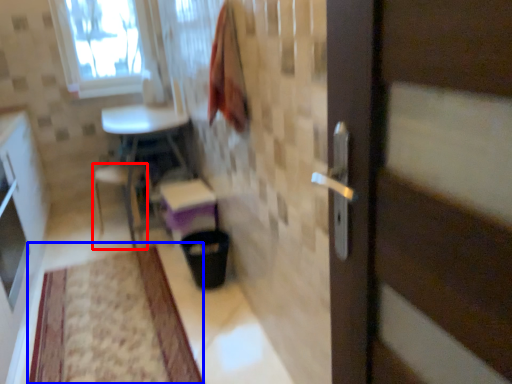
Question: Which object appears closest to the camera in this image, chair (highlighted by a red box) or mat (highlighted by a blue box)?

Choices:
 (A) chair
 (B) mat

Answer: (B)